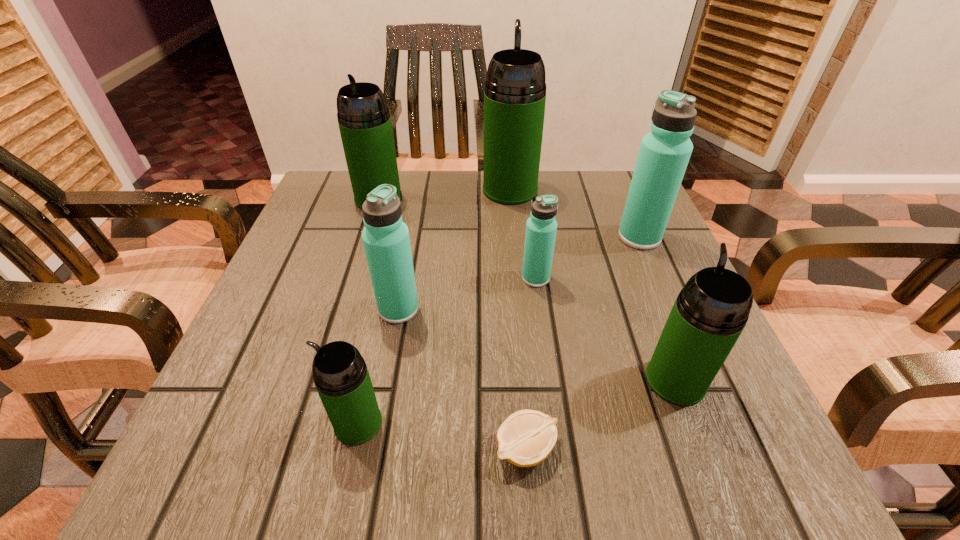
You are a GUI agent. You are given a task and a screenshot of the screen. Output one action in this format:
    pyautogui.click(x=<x>, y=<y>)
    Task: Click on the free space located from the spout of the smallest green thermos bottle
    This screenshot has height=540, width=960.
    Given the screenshot: What is the action you would take?
    pyautogui.click(x=300, y=423)

The height and width of the screenshot is (540, 960). Identify the location of vacant region located 0.360m on the left of the yellow lemon. (229, 449).

You are a GUI agent. You are given a task and a screenshot of the screen. Output one action in this format:
    pyautogui.click(x=<x>, y=<y>)
    Task: Click on the thermos bottle that is positioned at the near edge
    This screenshot has height=540, width=960.
    Given the screenshot: What is the action you would take?
    pyautogui.click(x=341, y=377)

What are the coordinates of `lemon positioned at the near edge` in the screenshot? It's located at (526, 438).

Find the location of a particular element. This screenshot has height=540, width=960. object present at the left edge is located at coordinates [x=364, y=120].

Find the location of a particular element. object at the far left corner is located at coordinates (364, 120).

The width and height of the screenshot is (960, 540). I want to click on object present at the far right corner, so click(x=664, y=153).

In the image, there is a desktop. Where is `vacant space at the far edge`? vacant space at the far edge is located at coordinates (x=544, y=173).

You are a GUI agent. You are given a task and a screenshot of the screen. Output one action in this format:
    pyautogui.click(x=<x>, y=<y>)
    Task: Click on the vacant space at the left edge
    This screenshot has height=540, width=960.
    Given the screenshot: What is the action you would take?
    pyautogui.click(x=233, y=397)

Where is `free space at the right edge`? free space at the right edge is located at coordinates (596, 258).